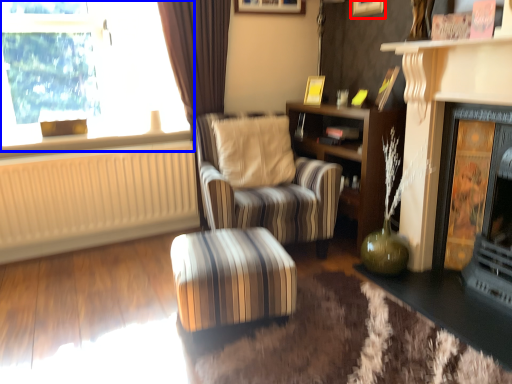
Question: Among these objects, which one is nearest to the camera, picture frame (highlighted by a red box) or window (highlighted by a blue box)?

Choices:
 (A) picture frame
 (B) window

Answer: (B)